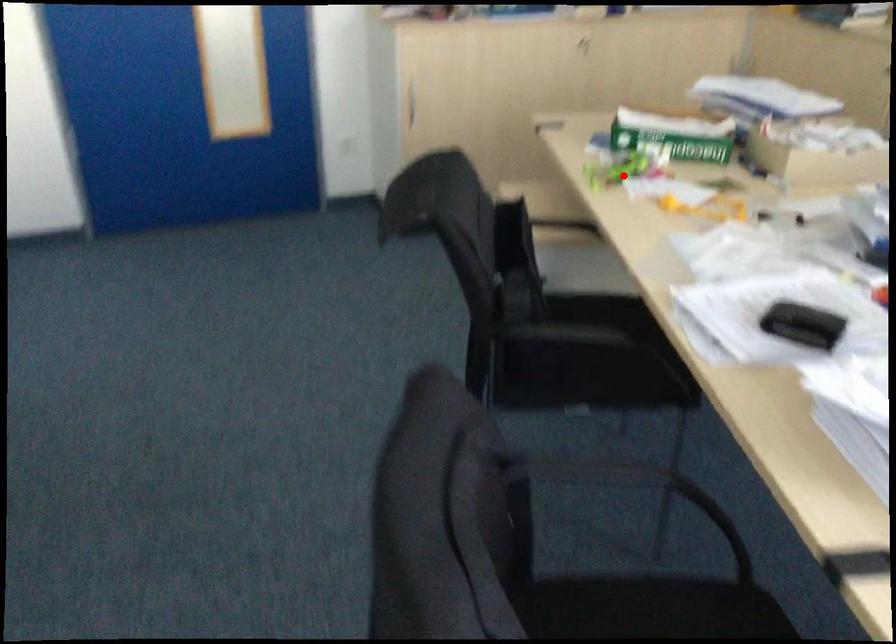
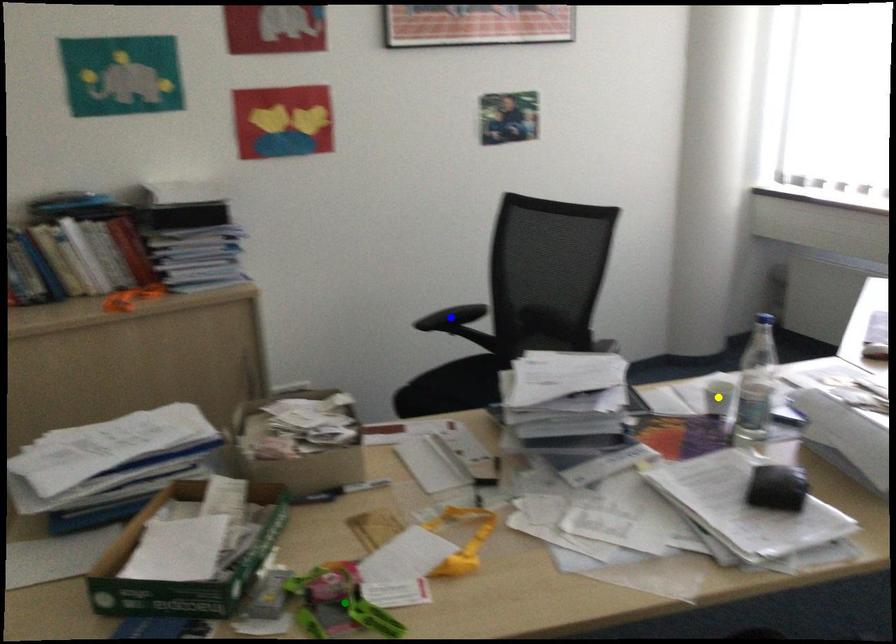
Question: I am providing you with two images of the same scene from different viewpoints. A red point is marked on the first image. You are given multiple points on the second image. Which point in image 2 is actually the same real-world point as the red point in image 1?

Choices:
 (A) green point
 (B) blue point
 (C) yellow point

Answer: (A)